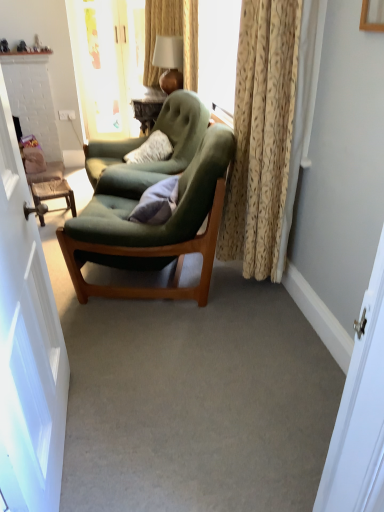
Question: Looking at the image, does matte gold lamp at upper center seem bigger or smaller compared to velvet green armchair at center, which is the first chair in back-to-front order?

Choices:
 (A) big
 (B) small

Answer: (B)

Question: Would you say matte gold lamp at upper center is inside or outside velvet green armchair at center, which is the first chair in back-to-front order?

Choices:
 (A) inside
 (B) outside

Answer: (B)

Question: Which object is positioned closest to the wooden textured stool at left?

Choices:
 (A) beige textured curtain at right
 (B) transparent glass door at upper center
 (C) gray fabric pillow at center
 (D) velvet green armchair at center, the 2th chair from the front
 (E) velvet green armchair at center, the 1th chair from the front

Answer: (D)

Question: Which object is positioned closest to the transparent glass door at upper center?

Choices:
 (A) white glossy door at left
 (B) wooden textured stool at left
 (C) velvet green armchair at center, the 1th chair from the front
 (D) gray fabric pillow at center
 (E) beige textured curtain at right

Answer: (B)